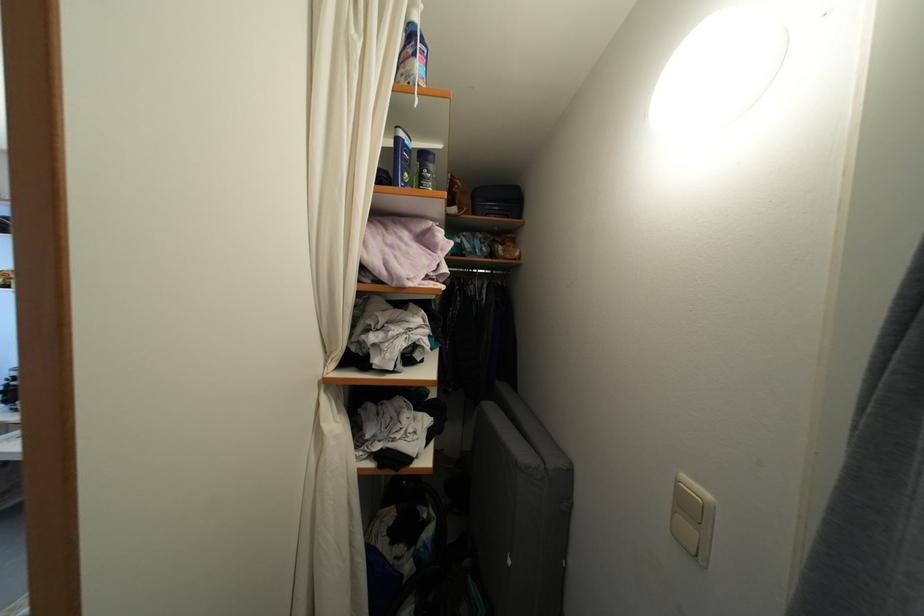
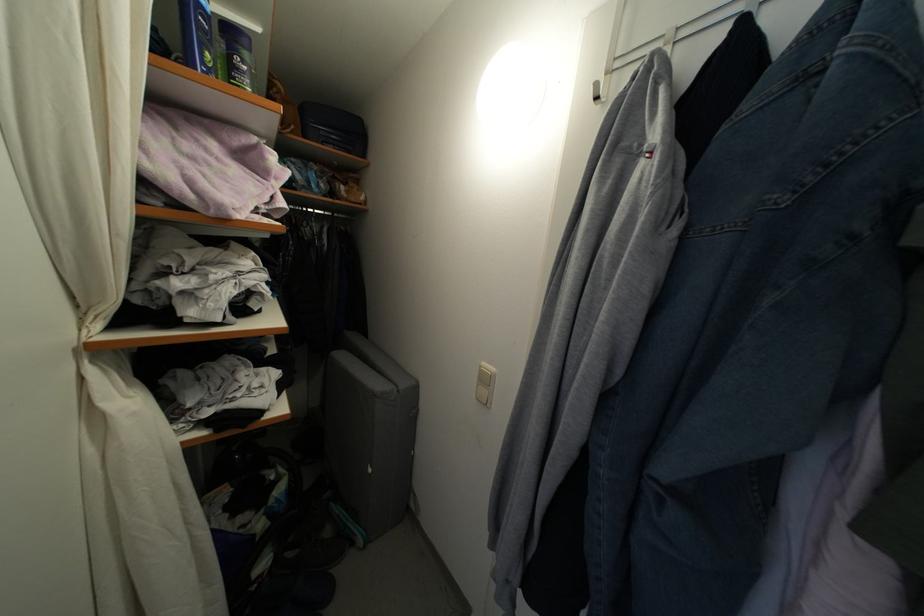
Where in the second image is the point corresponding to (x=492, y=214) from the first image?

(327, 139)